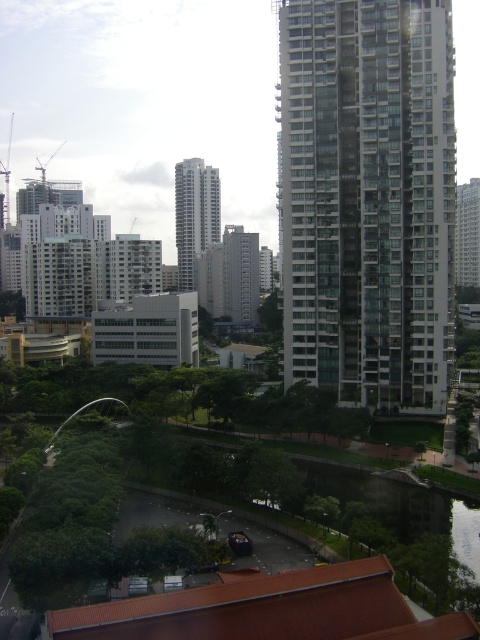
You are standing on the red roof in the foreground looking towards the city. Which object, the glassy white building at right or the glassy reflective skyscraper at center, is closer to you?

The glassy white building at right is closer to you because it is positioned in front of the glassy reflective skyscraper at center.

From the picture: You are standing at the camera position and want to take a photo of the glassy white building at right. If your camera has a maximum zoom range of 100 meters, can you capture the entire building in the photo without moving closer?

The glassy white building at right is 108.35 meters away from the camera. Since the camera can only zoom up to 100 meters, you cannot capture the entire building without moving closer.